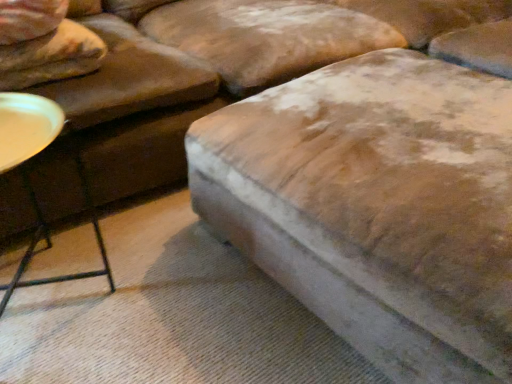
What do you see at coordinates (34, 192) in the screenshot? I see `matte black side table at left` at bounding box center [34, 192].

The image size is (512, 384). Identify the location of matte black side table at left. (34, 192).

In order to face matte black side table at left, should I rotate leftwards or rightwards?

To align with it, rotate left about 28.784°.

Identify the location of matte black side table at left. (34, 192).